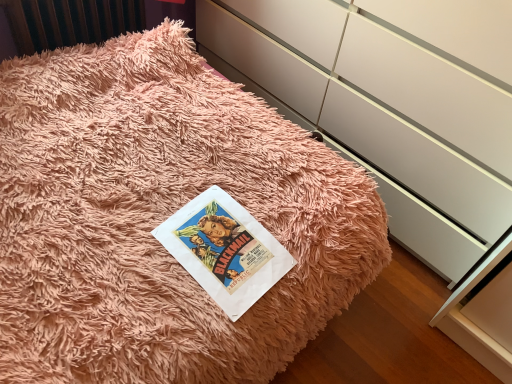
I want to click on white glossy cabinetry at center, so click(x=392, y=105).

Describe the element at coordinates (392, 105) in the screenshot. I see `white glossy cabinetry at center` at that location.

This screenshot has width=512, height=384. Find the location of `vintage paper at center`. vintage paper at center is located at coordinates (225, 250).

The width and height of the screenshot is (512, 384). Describe the element at coordinates (225, 250) in the screenshot. I see `vintage paper at center` at that location.

Measure the distance between vintage paper at center and camera.

The distance of vintage paper at center from camera is 35.91 inches.

This screenshot has height=384, width=512. Identify the location of white glossy cabinetry at center. (392, 105).

Visually, is white glossy cabinetry at center positioned to the left or to the right of vintage paper at center?

Clearly, white glossy cabinetry at center is on the right of vintage paper at center in the image.

Which is in front, white glossy cabinetry at center or vintage paper at center?

Positioned in front is white glossy cabinetry at center.

Which is more distant, (322,78) or (256,249)?

The point (322,78) is farther.

From the image's perspective, which object appears higher, white glossy cabinetry at center or vintage paper at center?

From the image's view, white glossy cabinetry at center is above.

From a real-world perspective, is white glossy cabinetry at center on vintage paper at center?

Yes, from a real-world perspective, white glossy cabinetry at center is above vintage paper at center.

Which of these two, white glossy cabinetry at center or vintage paper at center, is thinner?

vintage paper at center.

Does white glossy cabinetry at center have a greater height compared to vintage paper at center?

Yes, white glossy cabinetry at center is taller than vintage paper at center.

Is white glossy cabinetry at center bigger or smaller than vintage paper at center?

white glossy cabinetry at center is bigger than vintage paper at center.

Consider the image. Is white glossy cabinetry at center surrounding vintage paper at center?

No, vintage paper at center is not surrounded by white glossy cabinetry at center.

Is white glossy cabinetry at center next to vintage paper at center?

No, white glossy cabinetry at center is not next to vintage paper at center.

Is white glossy cabinetry at center turned away from vintage paper at center?

No, vintage paper at center is not at the back of white glossy cabinetry at center.

Measure the distance from white glossy cabinetry at center to vintage paper at center.

66.87 centimeters.

The height and width of the screenshot is (384, 512). In order to click on paperback book behind the white glossy cabinetry at center in this screenshot , I will do `click(225, 250)`.

Is vintage paper at center to the left of white glossy cabinetry at center from the viewer's perspective?

Correct, you'll find vintage paper at center to the left of white glossy cabinetry at center.

Considering the positions of objects vintage paper at center and white glossy cabinetry at center in the image provided, who is in front, vintage paper at center or white glossy cabinetry at center?

white glossy cabinetry at center is more forward.

Which is behind, point (278, 242) or point (322, 14)?

The point (322, 14) is farther.

From the image's perspective, is vintage paper at center located above or below white glossy cabinetry at center?

vintage paper at center is below white glossy cabinetry at center.

From a real-world perspective, which object stands above the other?

In real-world perspective, white glossy cabinetry at center is above.

Which of these two, vintage paper at center or white glossy cabinetry at center, is thinner?

vintage paper at center.

Which of these two, vintage paper at center or white glossy cabinetry at center, stands taller?

white glossy cabinetry at center is taller.

In terms of size, does vintage paper at center appear bigger or smaller than white glossy cabinetry at center?

In the image, vintage paper at center appears to be smaller than white glossy cabinetry at center.

In the scene shown: Is vintage paper at center not inside white glossy cabinetry at center?

Yes, vintage paper at center is not within white glossy cabinetry at center.

Is vintage paper at center positioned far away from white glossy cabinetry at center?

vintage paper at center is near white glossy cabinetry at center, not far away.

Is white glossy cabinetry at center at the back of vintage paper at center?

vintage paper at center is not turned away from white glossy cabinetry at center.

Locate an element on the screen. The width and height of the screenshot is (512, 384). cabinetry in front of the vintage paper at center is located at coordinates (392, 105).

The image size is (512, 384). In order to click on cabinetry on the right of vintage paper at center in this screenshot , I will do `click(392, 105)`.

The height and width of the screenshot is (384, 512). I want to click on paperback book that is below the white glossy cabinetry at center (from the image's perspective), so click(225, 250).